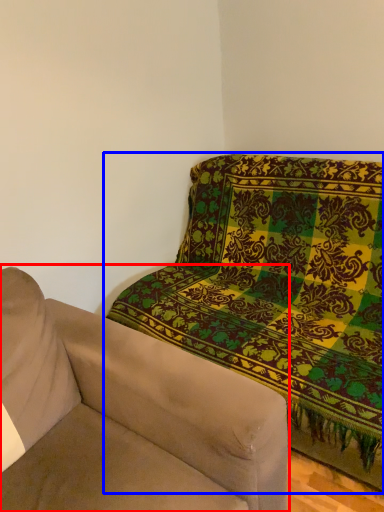
Question: Among these objects, which one is farthest to the camera, studio couch (highlighted by a red box) or studio sofa (highlighted by a blue box)?

Choices:
 (A) studio couch
 (B) studio sofa

Answer: (B)